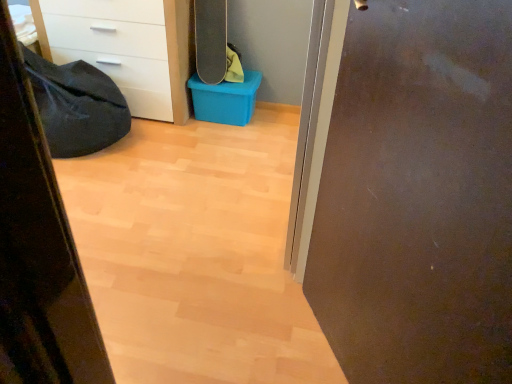
Question: Considering the positions of blue plastic storage box at center and black matte skateboard at upper center in the image, is blue plastic storage box at center bigger or smaller than black matte skateboard at upper center?

Choices:
 (A) small
 (B) big

Answer: (B)

Question: Is blue plastic storage box at center in front of or behind black matte skateboard at upper center in the image?

Choices:
 (A) front
 (B) behind

Answer: (B)

Question: Which is nearer to the black fabric sleeping bag at left?

Choices:
 (A) white glossy chest of drawers at upper left
 (B) matte brown door at right
 (C) blue plastic storage box at center
 (D) black matte skateboard at upper center

Answer: (A)

Question: Which of these objects is positioned farthest from the matte brown door at right?

Choices:
 (A) blue plastic storage box at center
 (B) black matte skateboard at upper center
 (C) black fabric sleeping bag at left
 (D) white glossy chest of drawers at upper left

Answer: (D)